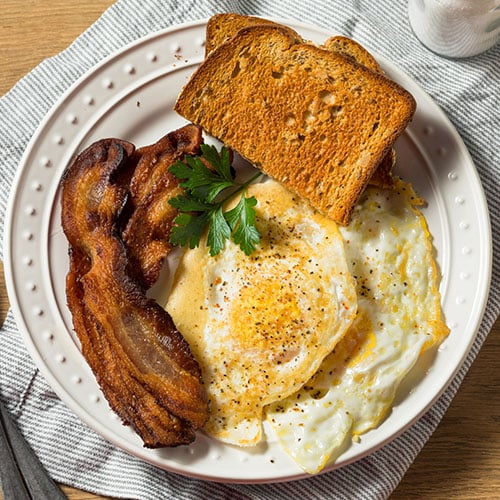
This screenshot has width=500, height=500. In order to click on silverware in this screenshot , I will do `click(14, 491)`, `click(37, 487)`.